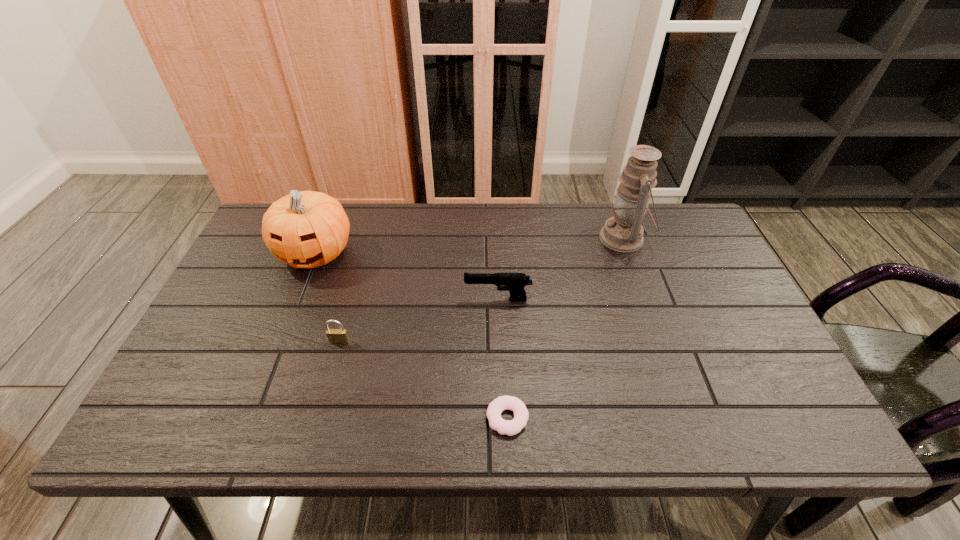
Locate an element on the screen. This screenshot has height=540, width=960. vacant point located on the front of the tallest object is located at coordinates (639, 282).

The width and height of the screenshot is (960, 540). In order to click on vacant position located 0.230m on the front-facing side of the leftmost object in this screenshot , I will do `click(277, 348)`.

The width and height of the screenshot is (960, 540). In order to click on free location located 0.240m on the front-facing side of the third nearest object in this screenshot , I will do `click(375, 299)`.

Image resolution: width=960 pixels, height=540 pixels. In order to click on free location located on the front-facing side of the third nearest object in this screenshot , I will do `click(386, 299)`.

The image size is (960, 540). Find the location of `blank space located 0.180m on the front-facing side of the third nearest object`. blank space located 0.180m on the front-facing side of the third nearest object is located at coordinates (397, 299).

I want to click on vacant region located 0.180m on the front-facing side of the second shortest object, so click(321, 412).

Image resolution: width=960 pixels, height=540 pixels. I want to click on free space located 0.310m on the left of the nearest object, so click(x=341, y=418).

You are a GUI agent. You are given a task and a screenshot of the screen. Output one action in this format:
    pyautogui.click(x=<x>, y=<y>)
    Task: Click on the oil lamp positioned at the far edge
    This screenshot has width=960, height=540.
    Given the screenshot: What is the action you would take?
    pyautogui.click(x=623, y=232)

The image size is (960, 540). In order to click on pumpkin that is at the far edge in this screenshot , I will do `click(306, 229)`.

At what (x,y) coordinates should I click in order to perform the action: click on object at the near edge. Please return your answer as a coordinate pair (x, y). Looking at the image, I should click on (497, 406).